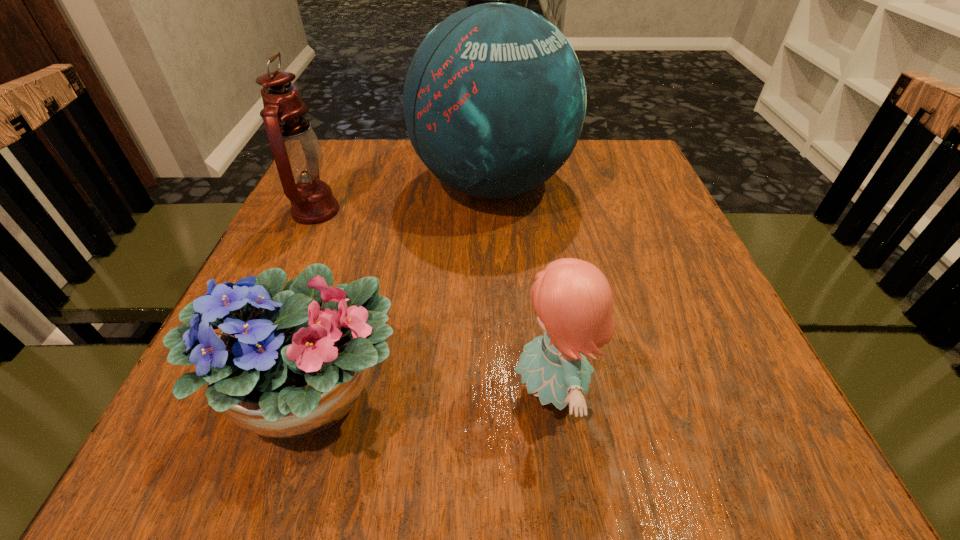
Locate an element on the screen. Image resolution: width=960 pixels, height=540 pixels. globe is located at coordinates (494, 100).

Find the location of a particular element. This screenshot has height=540, width=960. the third shortest object is located at coordinates tap(297, 152).

I want to click on doll, so click(573, 300).

Where is `bouquet`? Image resolution: width=960 pixels, height=540 pixels. bouquet is located at coordinates (291, 364).

Identify the location of blank area located on the front of the globe. Image resolution: width=960 pixels, height=540 pixels. (498, 346).

Where is `vacant space situated on the right of the oil lamp`? This screenshot has height=540, width=960. vacant space situated on the right of the oil lamp is located at coordinates (371, 211).

The image size is (960, 540). What are the coordinates of `vacant space situated on the front-facing side of the doll` in the screenshot? It's located at (432, 390).

Locate an element on the screen. This screenshot has height=540, width=960. vacant space positioned on the front-facing side of the doll is located at coordinates pyautogui.click(x=412, y=390).

At what (x,y) coordinates should I click in order to perform the action: click on blank space located 0.300m on the front-facing side of the doll. Please return your answer as a coordinate pair (x, y). This screenshot has height=540, width=960. Looking at the image, I should click on (311, 390).

Find the location of `vacant space located on the right of the shortest object`. vacant space located on the right of the shortest object is located at coordinates (554, 395).